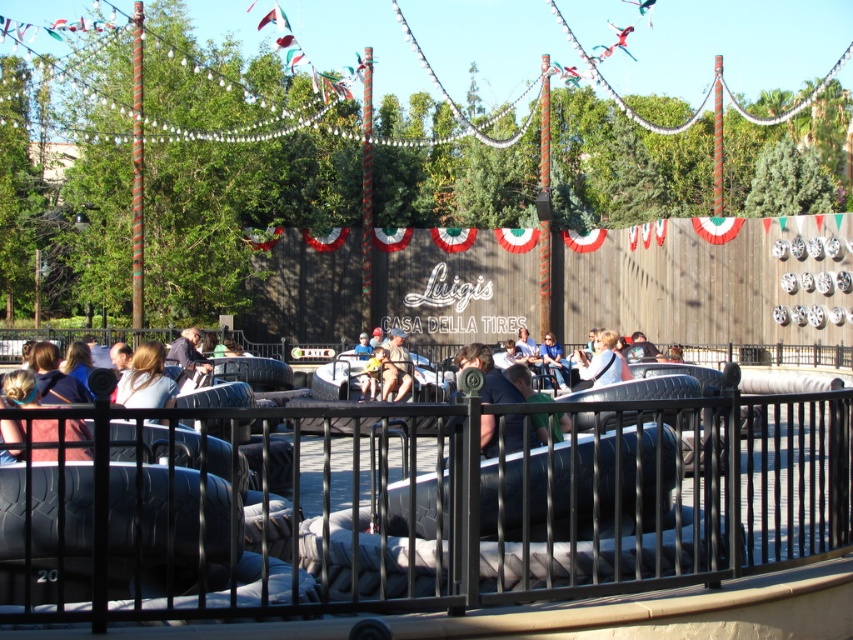
You are standing at the entrance of Luigi Casa Della Tires attraction and want to know how far the point at coordinates point (129, 394) is from you. Can you determine the distance?

The distance of point (129, 394) from camera is 84.47 feet.

You are standing at the entrance of Luigi Casa Della Tires and see a person wearing a light blue shirt at center and light blue denim jeans at center. The attraction requires visitors to maintain a minimum distance of 15 feet between themselves and the tires. Can you confirm if the person is complying with this safety rule?

The light blue shirt at center is 18.43 feet away from light blue denim jeans at center. Since the required distance is 15 feet, the person is complying with the safety rule as they are maintaining a distance greater than the minimum requirement.